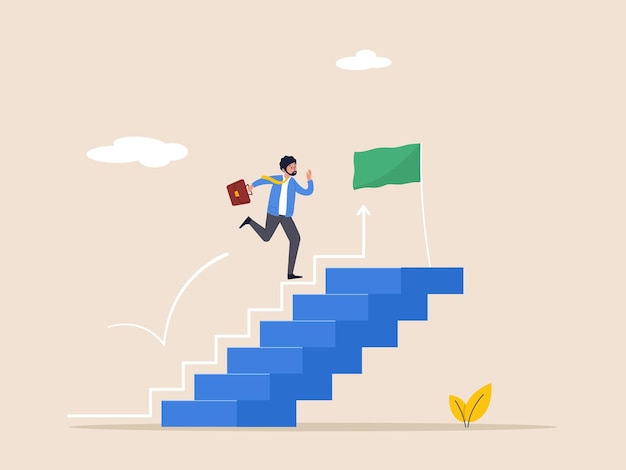
At what (x,y) coordinates should I click in order to perform the action: click on stairs. Please return your answer as a coordinate pair (x, y). Looking at the image, I should click on (206, 402), (249, 379), (279, 365), (319, 324), (347, 311), (377, 270).